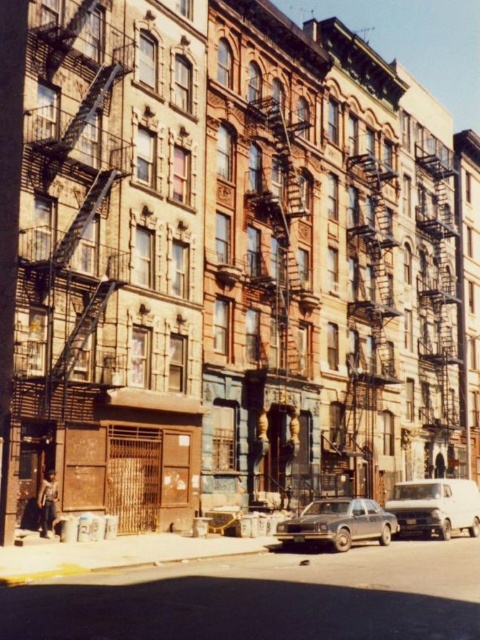
Which is more to the left, white matte van at center or matte gray sedan at center?

From the viewer's perspective, matte gray sedan at center appears more on the left side.

Does white matte van at center have a smaller size compared to matte gray sedan at center?

No, white matte van at center is not smaller than matte gray sedan at center.

Between point (400, 509) and point (348, 532), which one is positioned behind?

Point (400, 509)

I want to click on white matte van at center, so click(x=435, y=506).

Is rusty metal fire escape at center further to the viewer compared to white matte van at center?

Yes, it is behind white matte van at center.

Is rusty metal fire escape at center shorter than white matte van at center?

Incorrect, rusty metal fire escape at center's height does not fall short of white matte van at center's.

Which is in front, point (305, 161) or point (442, 522)?

Point (442, 522) is in front.

You are a GUI agent. You are given a task and a screenshot of the screen. Output one action in this format:
    pyautogui.click(x=<x>, y=<y>)
    Task: Click on the rusty metal fire escape at center
    
    Given the screenshot: What is the action you would take?
    pyautogui.click(x=282, y=300)

The image size is (480, 640). What do you see at coordinates (282, 300) in the screenshot?
I see `rusty metal fire escape at center` at bounding box center [282, 300].

From the picture: Who is taller, rusty metal fire escape at center or matte gray sedan at center?

With more height is rusty metal fire escape at center.

Who is more forward, (309, 403) or (332, 508)?

Point (332, 508)

Locate an element on the screen. Image resolution: width=480 pixels, height=640 pixels. rusty metal fire escape at center is located at coordinates (282, 300).